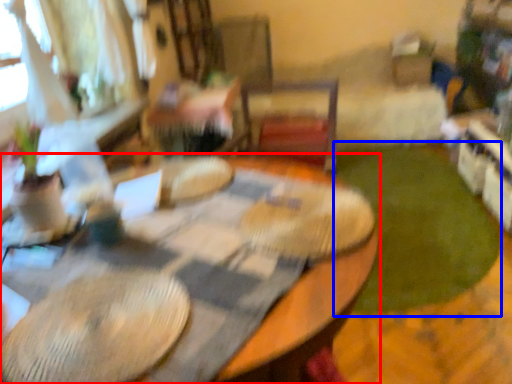
Question: Which object appears closest to the camera in this image, table (highlighted by a red box) or grass (highlighted by a blue box)?

Choices:
 (A) table
 (B) grass

Answer: (A)